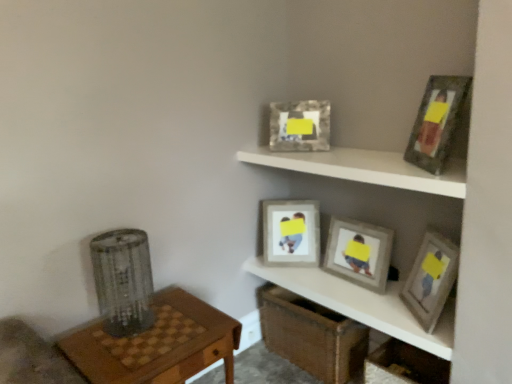
Find the location of `blank space situated above wooden picture frames at center, acting as the 2th shelf starting from the top (from a real-world perspective)`. blank space situated above wooden picture frames at center, acting as the 2th shelf starting from the top (from a real-world perspective) is located at coordinates (345, 288).